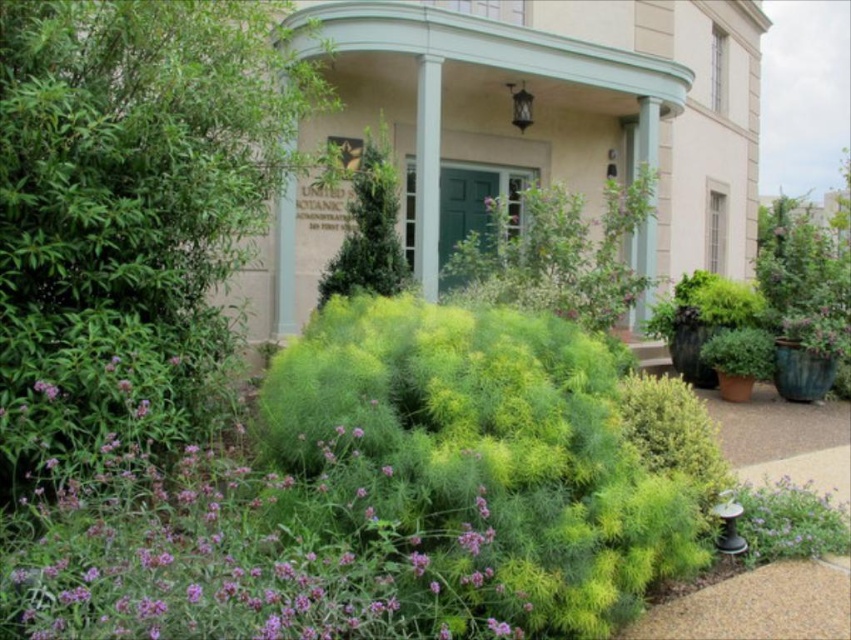
Question: Which object is the closest to the green fuzzy bush at left?

Choices:
 (A) purple matte flower at lower left
 (B) purple soft-textured flowers at center
 (C) green fuzzy bush at center

Answer: (B)

Question: Can you confirm if green leafy bush at center is bigger than green fuzzy bush at center?

Choices:
 (A) yes
 (B) no

Answer: (B)

Question: Which point is farther from the camera taking this photo?

Choices:
 (A) (232, 134)
 (B) (495, 252)
 (C) (433, 540)

Answer: (B)

Question: Which object is the closest to the green fuzzy bush at center?

Choices:
 (A) green leafy bush at center
 (B) green fuzzy bush at left
 (C) purple matte flower at lower left

Answer: (A)

Question: Is purple soft-textured flowers at center further to the viewer compared to purple matte flower at center?

Choices:
 (A) yes
 (B) no

Answer: (B)

Question: Is green fuzzy bush at left closer to the viewer compared to green fluffy bush at center?

Choices:
 (A) no
 (B) yes

Answer: (A)